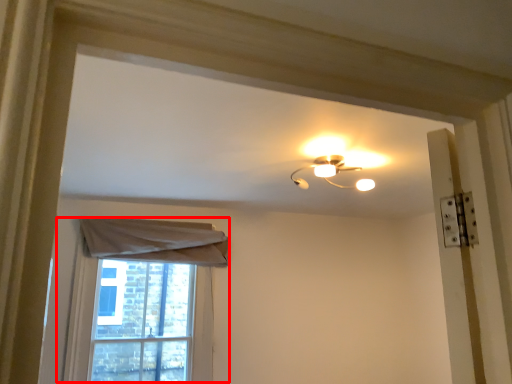
Question: From the image's perspective, where is window (annotated by the red box) located in relation to lamp in the image?

Choices:
 (A) above
 (B) below

Answer: (B)